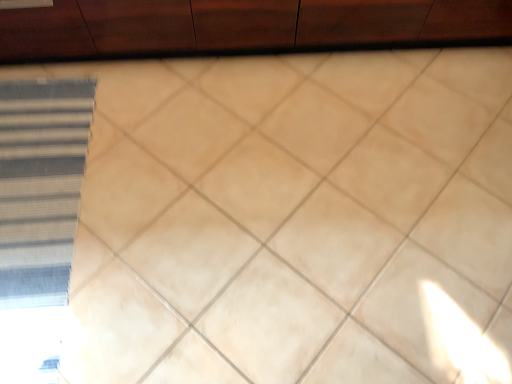
Where is `unoccupied region to the right of textured beige curtain at left`? The width and height of the screenshot is (512, 384). unoccupied region to the right of textured beige curtain at left is located at coordinates (154, 226).